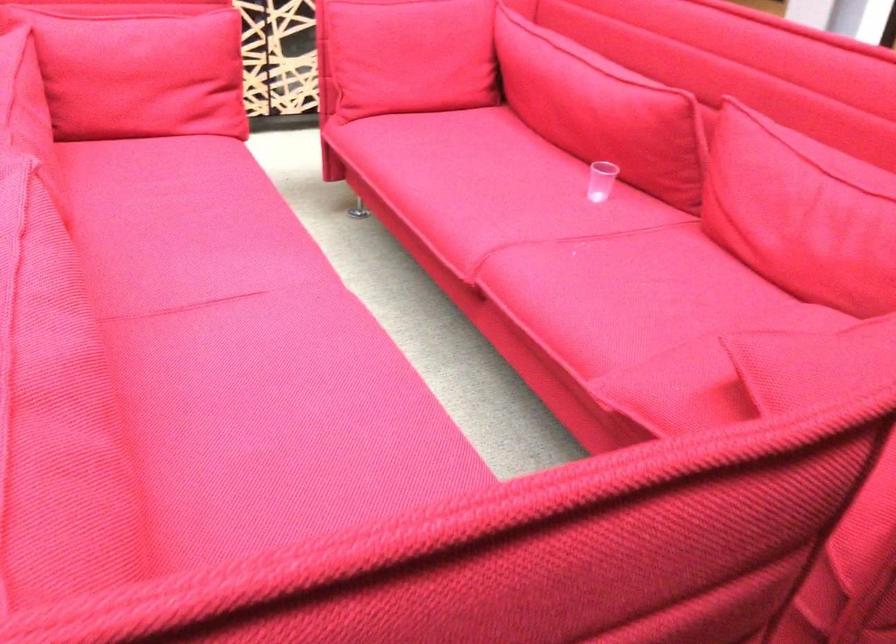
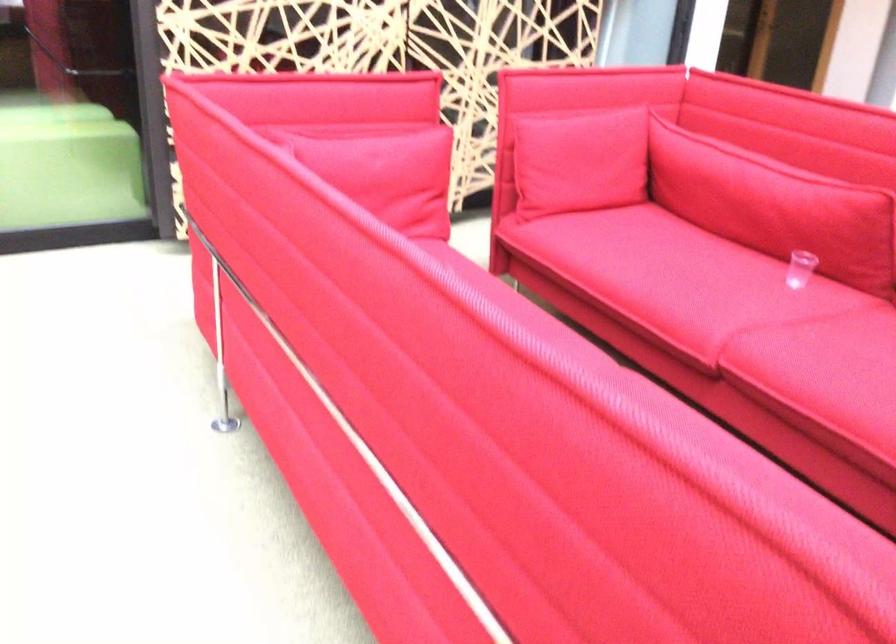
Question: In a continuous first-person perspective shot, in which direction is the camera moving?

Choices:
 (A) Left
 (B) Right
 (C) Forward
 (D) Backward

Answer: (A)